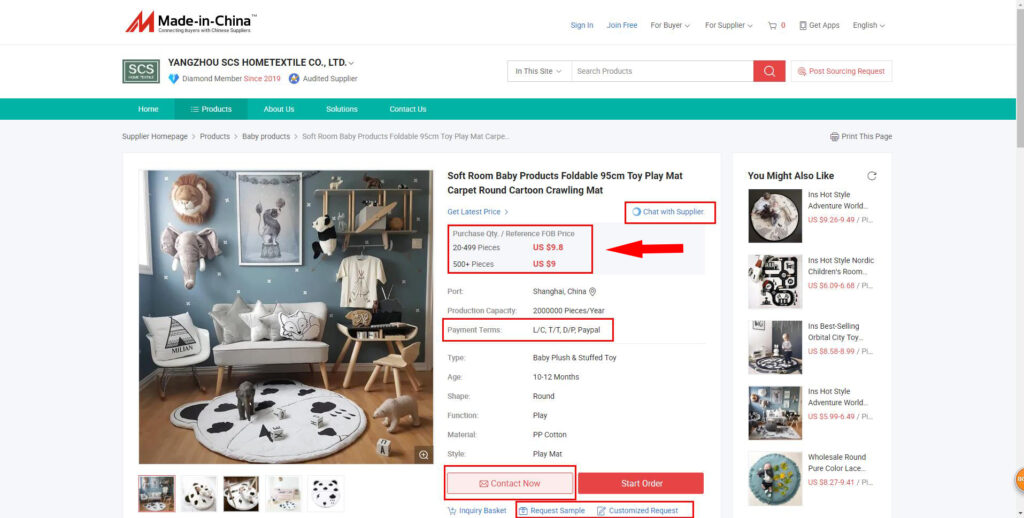
I want to click on poster of circus animal, so click(261, 232).